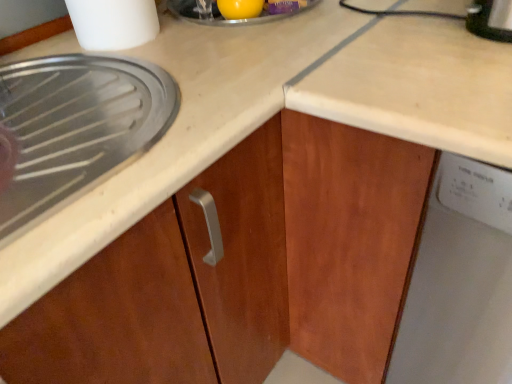
Describe the element at coordinates (179, 285) in the screenshot. I see `matte wood cabinet at left` at that location.

What do you see at coordinates (113, 23) in the screenshot? The width and height of the screenshot is (512, 384). I see `white plastic container at upper left` at bounding box center [113, 23].

The height and width of the screenshot is (384, 512). What are the coordinates of `yellow rubber ball at upper center` in the screenshot? It's located at (226, 19).

Where is `matte wood cabinet at left`? The width and height of the screenshot is (512, 384). matte wood cabinet at left is located at coordinates (179, 285).

Consider the image. Would you say white plastic dishwasher at right is outside yellow rubber ball at upper center?

Indeed, white plastic dishwasher at right is completely outside yellow rubber ball at upper center.

Who is smaller, white plastic dishwasher at right or yellow rubber ball at upper center?

yellow rubber ball at upper center.

From the picture: Are white plastic dishwasher at right and yellow rubber ball at upper center beside each other?

No, white plastic dishwasher at right is not beside yellow rubber ball at upper center.

Does white plastic dishwasher at right have a greater height compared to yellow rubber ball at upper center?

Indeed, white plastic dishwasher at right has a greater height compared to yellow rubber ball at upper center.

Based on their positions, is white plastic dishwasher at right located to the left or right of matte wood cabinet at left?

In the image, white plastic dishwasher at right appears on the right side of matte wood cabinet at left.

Who is smaller, white plastic dishwasher at right or matte wood cabinet at left?

With smaller size is matte wood cabinet at left.

From a real-world perspective, is white plastic dishwasher at right on top of matte wood cabinet at left?

Incorrect, from a real-world perspective, white plastic dishwasher at right is lower than matte wood cabinet at left.

This screenshot has width=512, height=384. What are the coordinates of `home appliance located below the matte wood cabinet at left (from the image's perspective)` in the screenshot? It's located at (460, 281).

Considering the relative sizes of yellow rubber ball at upper center and white plastic dishwasher at right in the image provided, is yellow rubber ball at upper center bigger than white plastic dishwasher at right?

Incorrect, yellow rubber ball at upper center is not larger than white plastic dishwasher at right.

Is point (242, 23) closer to camera compared to point (412, 316)?

No.

Is yellow rubber ball at upper center far away from white plastic dishwasher at right?

No, yellow rubber ball at upper center is in close proximity to white plastic dishwasher at right.

From the image's perspective, does yellow rubber ball at upper center appear higher than white plastic dishwasher at right?

Yes.

In the image, is white plastic container at upper left positioned in front of or behind yellow rubber ball at upper center?

white plastic container at upper left is positioned closer to the viewer than yellow rubber ball at upper center.

From a real-world perspective, is white plastic container at upper left located higher than yellow rubber ball at upper center?

Yes, from a real-world perspective, white plastic container at upper left is on top of yellow rubber ball at upper center.

How different are the orientations of white plastic container at upper left and yellow rubber ball at upper center in degrees?

white plastic container at upper left and yellow rubber ball at upper center are facing 34 degrees away from each other.

Is white plastic container at upper left turned away from yellow rubber ball at upper center?

white plastic container at upper left does not have its back to yellow rubber ball at upper center.

Does white plastic container at upper left contain white plastic dishwasher at right?

No, white plastic dishwasher at right is located outside of white plastic container at upper left.

In terms of size, does white plastic container at upper left appear bigger or smaller than white plastic dishwasher at right?

Considering their sizes, white plastic container at upper left takes up less space than white plastic dishwasher at right.

Considering the sizes of white plastic container at upper left and white plastic dishwasher at right in the image, is white plastic container at upper left wider or thinner than white plastic dishwasher at right?

Clearly, white plastic container at upper left has less width compared to white plastic dishwasher at right.

Is matte wood cabinet at left behind white plastic dishwasher at right?

Yes.

Can white plastic dishwasher at right be found inside matte wood cabinet at left?

No, white plastic dishwasher at right is not a part of matte wood cabinet at left.

From a real-world perspective, between matte wood cabinet at left and white plastic dishwasher at right, who is vertically higher?

In real-world perspective, matte wood cabinet at left is above.

Which of these two, matte wood cabinet at left or white plastic dishwasher at right, stands shorter?

matte wood cabinet at left.

Is white plastic container at upper left beside matte wood cabinet at left?

They are not placed beside each other.

You are a GUI agent. You are given a task and a screenshot of the screen. Output one action in this format:
    pyautogui.click(x=<x>, y=<y>)
    Task: Click on the cabinetry that is on the left side of white plastic container at upper left
    Image resolution: width=512 pixels, height=384 pixels.
    Given the screenshot: What is the action you would take?
    pyautogui.click(x=179, y=285)

Could you tell me if white plastic container at upper left is facing matte wood cabinet at left?

No, white plastic container at upper left is not aimed at matte wood cabinet at left.

Can you confirm if white plastic container at upper left is taller than matte wood cabinet at left?

Yes, white plastic container at upper left is taller than matte wood cabinet at left.

At what (x,y) coordinates should I click in order to perform the action: click on appliance on the left of white plastic dishwasher at right. Please return your answer as a coordinate pair (x, y). Looking at the image, I should click on (226, 19).

Locate an element on the screen. cabinetry that appears above the white plastic dishwasher at right (from a real-world perspective) is located at coordinates (179, 285).

Based on their spatial positions, is matte wood cabinet at left or white plastic dishwasher at right closer to yellow rubber ball at upper center?

matte wood cabinet at left.

Looking at the image, which one is located further to white plastic dishwasher at right, yellow rubber ball at upper center or white plastic container at upper left?

white plastic container at upper left.

From the image, which object appears to be farther from white plastic container at upper left, yellow rubber ball at upper center or matte wood cabinet at left?

matte wood cabinet at left is further to white plastic container at upper left.

Based on their spatial positions, is white plastic container at upper left or white plastic dishwasher at right closer to matte wood cabinet at left?

The object closer to matte wood cabinet at left is white plastic dishwasher at right.

From the image, which object appears to be nearer to matte wood cabinet at left, yellow rubber ball at upper center or white plastic container at upper left?

Based on the image, white plastic container at upper left appears to be nearer to matte wood cabinet at left.

Estimate the real-world distances between objects in this image. Which object is closer to yellow rubber ball at upper center, matte wood cabinet at left or white plastic container at upper left?

white plastic container at upper left lies closer to yellow rubber ball at upper center than the other object.

Which object lies further to the anchor point matte wood cabinet at left, white plastic container at upper left or yellow rubber ball at upper center?

yellow rubber ball at upper center is further to matte wood cabinet at left.

Considering their positions, is yellow rubber ball at upper center positioned closer to white plastic dishwasher at right than matte wood cabinet at left?

matte wood cabinet at left.

Identify the location of appliance between white plastic container at upper left and white plastic dishwasher at right from left to right. (226, 19).

You are a GUI agent. You are given a task and a screenshot of the screen. Output one action in this format:
    pyautogui.click(x=<x>, y=<y>)
    Task: Click on the kitchen appliance located between matte wood cabinet at left and white plastic dishwasher at right in the left-right direction
    This screenshot has width=512, height=384.
    Given the screenshot: What is the action you would take?
    pyautogui.click(x=113, y=23)

Find the location of `kitchen appliance between matte wood cabinet at left and yellow rubber ball at upper center along the z-axis`. kitchen appliance between matte wood cabinet at left and yellow rubber ball at upper center along the z-axis is located at coordinates (113, 23).

Locate an element on the screen. The height and width of the screenshot is (384, 512). appliance between matte wood cabinet at left and white plastic dishwasher at right is located at coordinates click(226, 19).